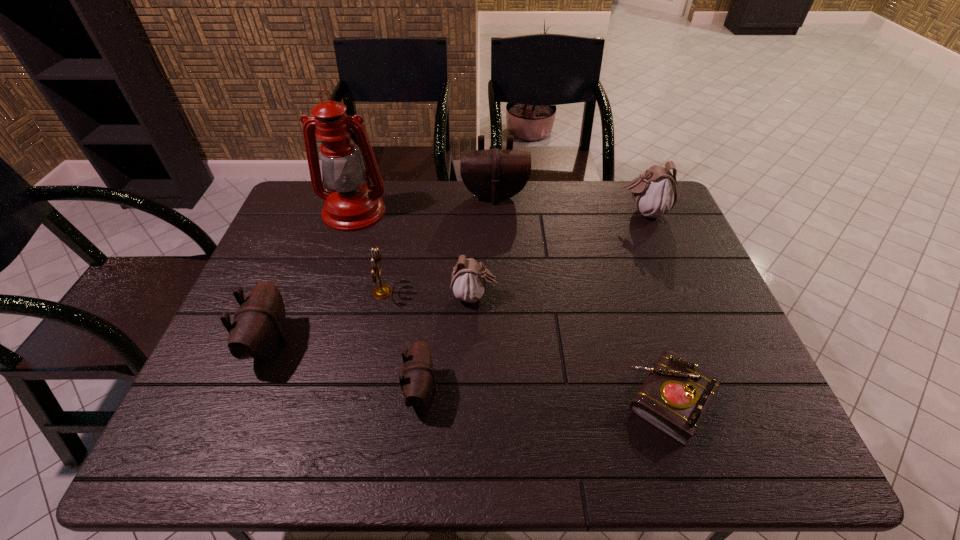
Where is `free space located with the flap open on the leftmost brown pouch`? The width and height of the screenshot is (960, 540). free space located with the flap open on the leftmost brown pouch is located at coordinates (335, 344).

What are the coordinates of `vacant space located on the front-facing side of the smaller white pouch` in the screenshot? It's located at (598, 296).

Identify the location of vacant region located 0.330m with the flap open on the fifth object from right to left. Image resolution: width=960 pixels, height=540 pixels. (x=585, y=392).

Identify the location of vacant space situated 0.290m on the left of the diary. The image size is (960, 540). (493, 400).

Find the location of a particular element. oil lamp at the far edge is located at coordinates (351, 205).

This screenshot has height=540, width=960. What are the coordinates of `object that is positioned at the near edge` in the screenshot? It's located at (674, 397).

Where is `oil lamp that is at the left edge`? This screenshot has height=540, width=960. oil lamp that is at the left edge is located at coordinates (351, 205).

Where is `pouch situated at the left edge`? pouch situated at the left edge is located at coordinates (258, 330).

Where is `pouch that is positioned at the right edge`? Image resolution: width=960 pixels, height=540 pixels. pouch that is positioned at the right edge is located at coordinates (655, 192).

Locate an element on the screen. The image size is (960, 540). diary that is positioned at the right edge is located at coordinates (674, 397).